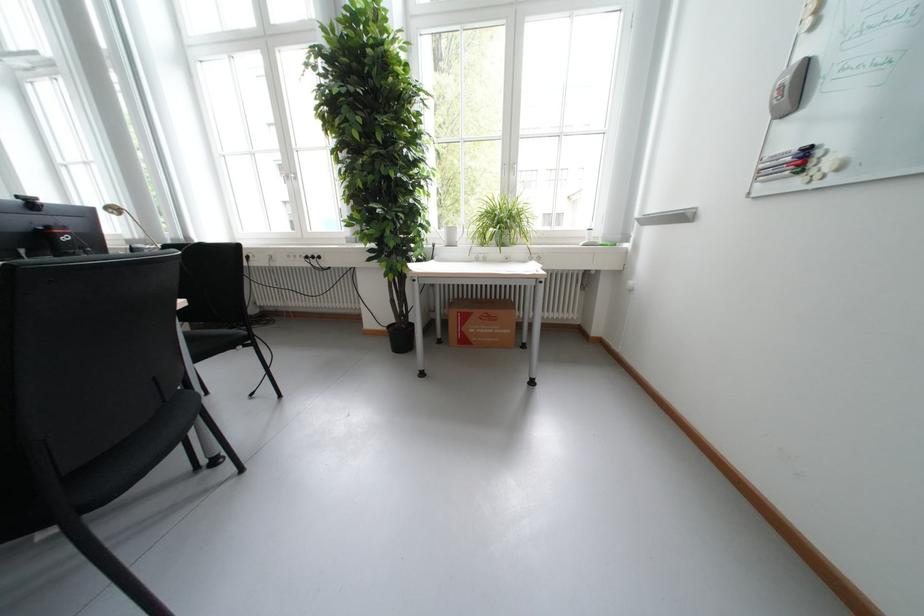
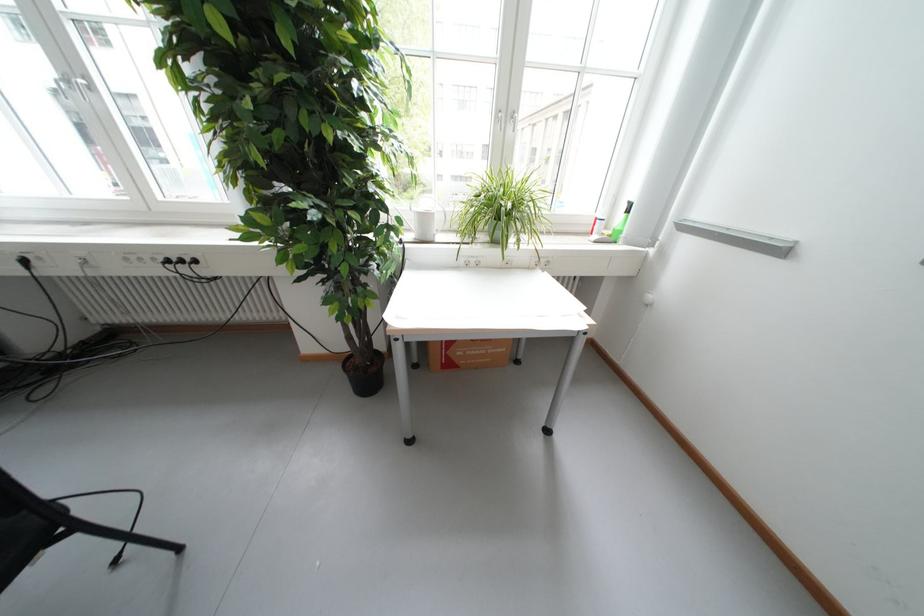
In the second image, find the point that corresponds to the point at 475,342 in the first image.

(458, 366)